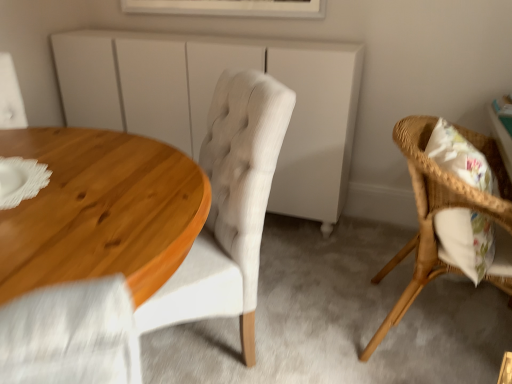
Question: From the image's perspective, is white framed picture at upper center on white matte cabinet at center?

Choices:
 (A) yes
 (B) no

Answer: (A)

Question: Would you consider white framed picture at upper center to be distant from white matte cabinet at center?

Choices:
 (A) no
 (B) yes

Answer: (A)

Question: Can you confirm if white framed picture at upper center is shorter than white matte cabinet at center?

Choices:
 (A) no
 (B) yes

Answer: (B)

Question: Are white framed picture at upper center and white matte cabinet at center making contact?

Choices:
 (A) yes
 (B) no

Answer: (B)

Question: Is white framed picture at upper center further to camera compared to white matte cabinet at center?

Choices:
 (A) yes
 (B) no

Answer: (A)

Question: Based on their positions, is light beige fabric chair at center, the 2th chair positioned from the right, located to the left or right of white matte cabinet at center?

Choices:
 (A) right
 (B) left

Answer: (A)

Question: Is light beige fabric chair at center, the 2th chair positioned from the right, bigger or smaller than white matte cabinet at center?

Choices:
 (A) small
 (B) big

Answer: (A)

Question: From the image's perspective, is light beige fabric chair at center, the 2th chair positioned from the right, above or below white matte cabinet at center?

Choices:
 (A) below
 (B) above

Answer: (A)

Question: In terms of width, does light beige fabric chair at center, which is the first chair in left-to-right order, look wider or thinner when compared to white matte cabinet at center?

Choices:
 (A) wide
 (B) thin

Answer: (A)

Question: From the image's perspective, relative to woven wood chair at right, which is the 1th chair in right-to-left order, is light beige fabric chair at center, the 2th chair positioned from the right, above or below?

Choices:
 (A) below
 (B) above

Answer: (B)

Question: Considering the positions of light beige fabric chair at center, which is the first chair in left-to-right order, and woven wood chair at right, which is the 1th chair in right-to-left order, in the image, is light beige fabric chair at center, which is the first chair in left-to-right order, bigger or smaller than woven wood chair at right, which is the 1th chair in right-to-left order,?

Choices:
 (A) small
 (B) big

Answer: (B)

Question: Is point (212, 160) positioned closer to the camera than point (421, 196)?

Choices:
 (A) farther
 (B) closer

Answer: (A)

Question: Considering the positions of light beige fabric chair at center, which is the first chair in left-to-right order, and woven wood chair at right, marked as the 2th chair in a left-to-right arrangement, in the image, is light beige fabric chair at center, which is the first chair in left-to-right order, taller or shorter than woven wood chair at right, marked as the 2th chair in a left-to-right arrangement,?

Choices:
 (A) short
 (B) tall

Answer: (B)

Question: From their relative heights in the image, would you say white framed picture at upper center is taller or shorter than white matte cabinet at center?

Choices:
 (A) tall
 (B) short

Answer: (B)

Question: Considering the positions of white framed picture at upper center and white matte cabinet at center in the image, is white framed picture at upper center wider or thinner than white matte cabinet at center?

Choices:
 (A) wide
 (B) thin

Answer: (B)